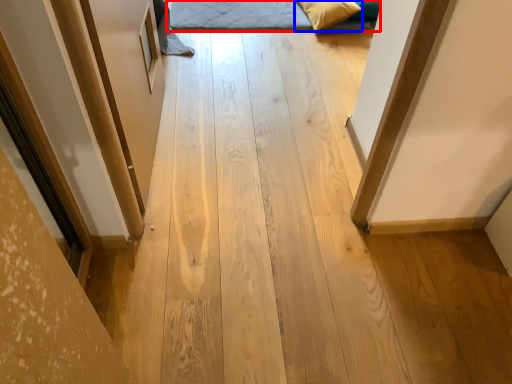
Question: Which point is closer to the camera, bed (highlighted by a red box) or pillow (highlighted by a blue box)?

Choices:
 (A) bed
 (B) pillow

Answer: (B)